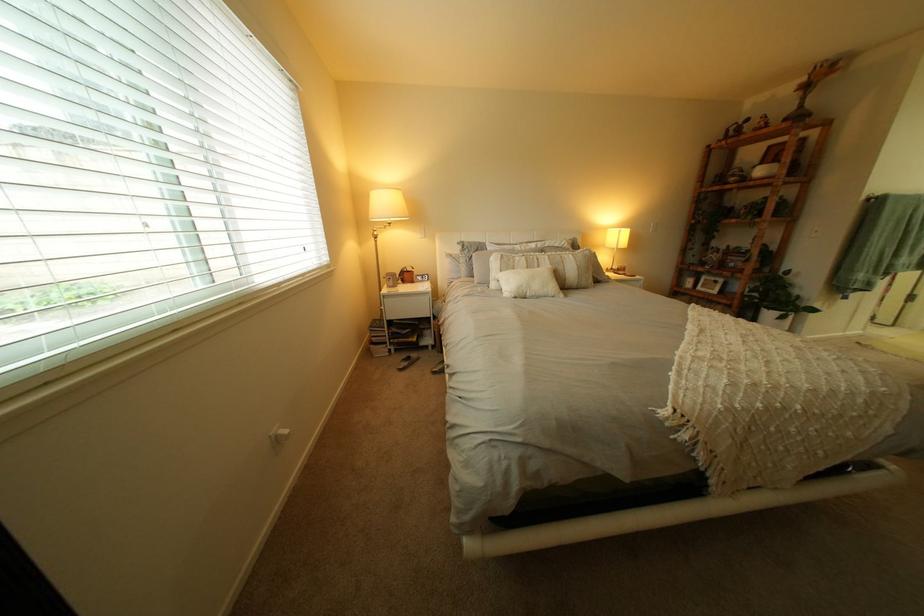
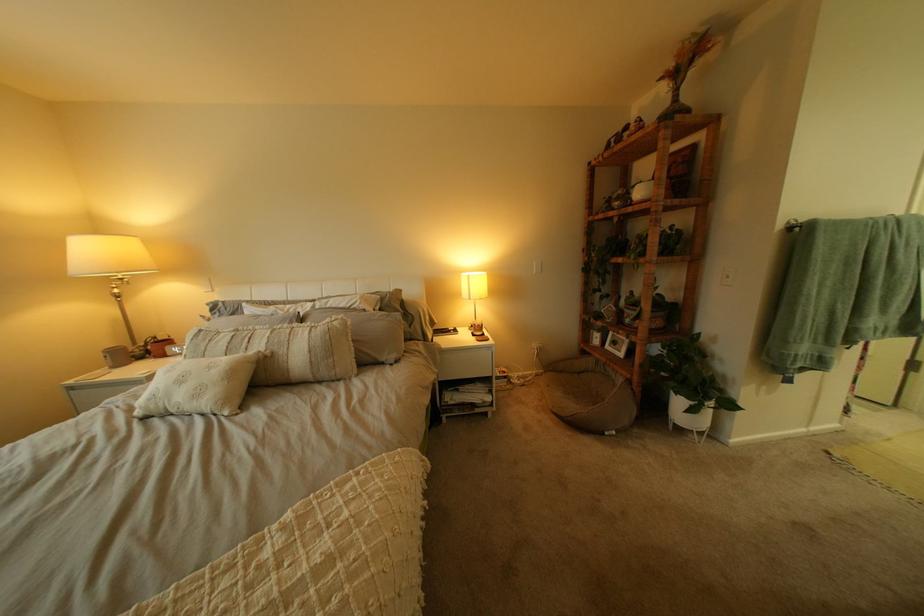
In the second image, find the point that corresponds to point 810,92 in the first image.

(675, 81)